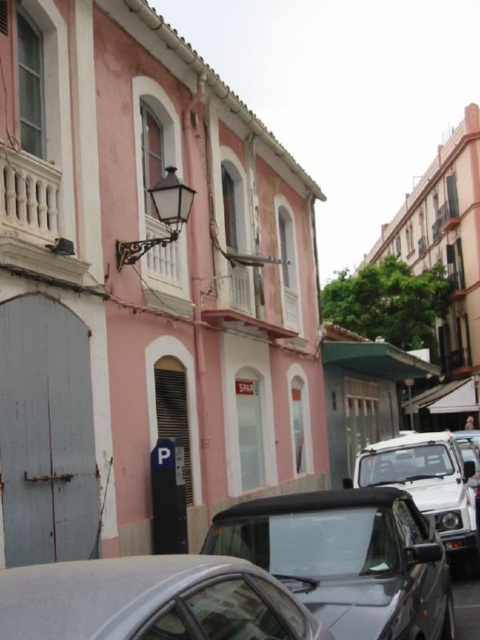
Can you confirm if black matte car at lower center is wider than satin silver car at lower center?

Yes.

Is black matte car at lower center to the right of satin silver car at lower center from the viewer's perspective?

Result: Correct, you'll find black matte car at lower center to the right of satin silver car at lower center.

Which is in front, point (436, 611) or point (183, 592)?

Point (183, 592) is in front.

The width and height of the screenshot is (480, 640). Find the location of `black matte car at lower center`. black matte car at lower center is located at coordinates (348, 557).

Does point (196, 624) come behind point (381, 440)?

That is False.

Who is more forward, (x=201, y=577) or (x=474, y=515)?

Point (x=201, y=577)

At what (x,y) coordinates should I click in order to perform the action: click on satin silver car at lower center. Please return your answer as a coordinate pair (x, y). Image resolution: width=480 pixels, height=640 pixels. Looking at the image, I should click on 151,600.

Image resolution: width=480 pixels, height=640 pixels. What are the coordinates of `satin silver car at lower center` in the screenshot? It's located at (151, 600).

Who is more distant from viewer, (305, 531) or (442, 449)?

The point (442, 449) is more distant.

Which is above, black matte car at lower center or metallic silver car at center?

black matte car at lower center

Between point (343, 579) and point (430, 476), which one is positioned behind?

The point (430, 476) is behind.

Identify the location of black matte car at lower center. Image resolution: width=480 pixels, height=640 pixels. (348, 557).